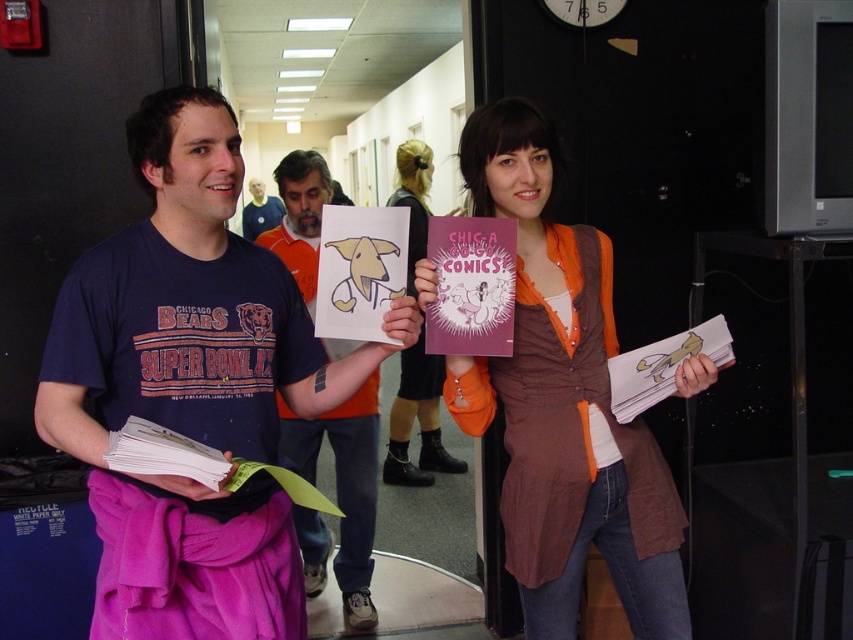
Question: Does brown fabric shirt at center come behind matte pink skirt at center?

Choices:
 (A) no
 (B) yes

Answer: (A)

Question: Is brown fabric shirt at center thinner than matte pink skirt at center?

Choices:
 (A) yes
 (B) no

Answer: (B)

Question: Which of these objects is positioned farthest from the brown fabric shirt at center?

Choices:
 (A) matte paper dog drawing at center
 (B) matte blue t-shirt at center

Answer: (A)

Question: Does matte blue t-shirt at center have a larger size compared to brown fabric shirt at center?

Choices:
 (A) yes
 (B) no

Answer: (B)

Question: Which point is farther from the camera taking this photo?

Choices:
 (A) (413, 160)
 (B) (640, 520)
 (C) (299, 506)

Answer: (A)

Question: Which of the following is the farthest from the observer?

Choices:
 (A) matte paper dog drawing at center
 (B) orange t-shirt at center
 (C) brown fabric shirt at center
 (D) matte blue t-shirt at center

Answer: (B)